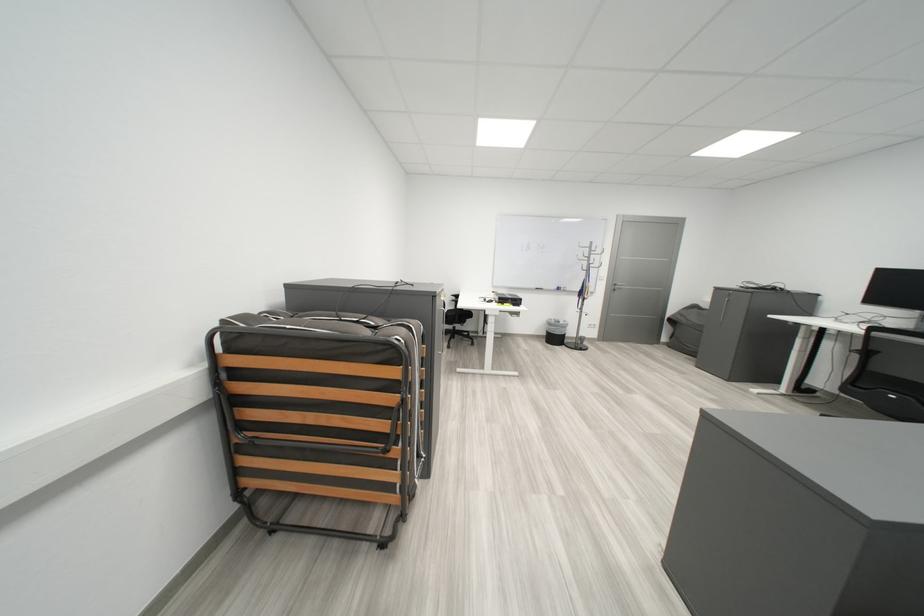
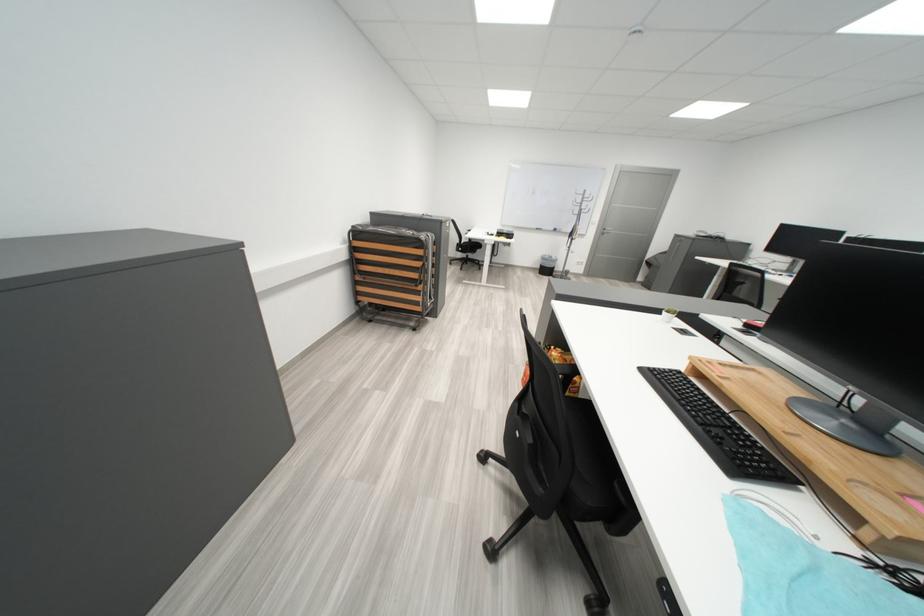
Question: Which direction would the cameraman need to move to produce the second image? Reply with the corresponding letter.

Choices:
 (A) Left
 (B) Right
 (C) Forward
 (D) Backward

Answer: (D)